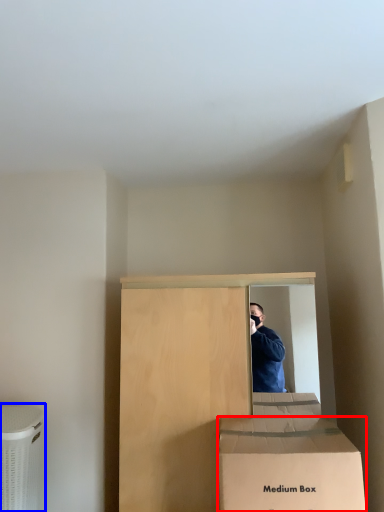
Question: Among these objects, which one is nearest to the camera, box (highlighted by a red box) or cardboard box (highlighted by a blue box)?

Choices:
 (A) box
 (B) cardboard box

Answer: (A)